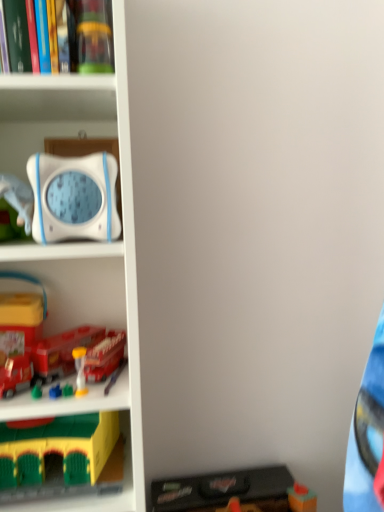
Question: Is white plastic bookcase at left positioned before hardcover book at upper left?

Choices:
 (A) no
 (B) yes

Answer: (B)

Question: Is white plastic bookcase at left located outside hardcover book at upper left?

Choices:
 (A) yes
 (B) no

Answer: (A)

Question: Is white plastic bookcase at left in contact with hardcover book at upper left?

Choices:
 (A) no
 (B) yes

Answer: (A)

Question: Can you confirm if white plastic bookcase at left is shorter than hardcover book at upper left?

Choices:
 (A) no
 (B) yes

Answer: (A)

Question: Is white plastic bookcase at left facing towards hardcover book at upper left?

Choices:
 (A) no
 (B) yes

Answer: (B)

Question: Is hardcover book at upper left inside the boundaries of translucent plastic hourglass at lower left, marked as the 2th toy in a left-to-right arrangement, or outside?

Choices:
 (A) outside
 (B) inside

Answer: (A)

Question: From the image's perspective, relative to translucent plastic hourglass at lower left, which appears as the 3th toy when viewed from the right, is hardcover book at upper left above or below?

Choices:
 (A) below
 (B) above

Answer: (B)

Question: Is point (8, 13) positioned closer to the camera than point (82, 373)?

Choices:
 (A) farther
 (B) closer

Answer: (B)

Question: In terms of size, does hardcover book at upper left appear bigger or smaller than translucent plastic hourglass at lower left, the 2th toy viewed from the top?

Choices:
 (A) big
 (B) small

Answer: (A)

Question: In terms of width, does translucent plastic hourglass at lower left, the third toy from the bottom, look wider or thinner when compared to hardcover book at upper left?

Choices:
 (A) thin
 (B) wide

Answer: (A)

Question: From a real-world perspective, is translucent plastic hourglass at lower left, which appears as the 3th toy when viewed from the right, positioned above or below hardcover book at upper left?

Choices:
 (A) below
 (B) above

Answer: (A)

Question: Would you say translucent plastic hourglass at lower left, marked as the 2th toy in a left-to-right arrangement, is to the left or to the right of hardcover book at upper left in the picture?

Choices:
 (A) right
 (B) left

Answer: (A)

Question: Is point (x=82, y=358) positioned closer to the camera than point (x=44, y=41)?

Choices:
 (A) closer
 (B) farther

Answer: (B)

Question: From a real-world perspective, is black plastic toy at lower right, marked as the 1th toy in a right-to-left arrangement, physically located above or below yellow plastic building block at lower left, which is counted as the second toy, starting from the bottom?

Choices:
 (A) below
 (B) above

Answer: (A)

Question: Is black plastic toy at lower right, marked as the 1th toy in a right-to-left arrangement, wider or thinner than yellow plastic building block at lower left, which is the 1th toy from left to right?

Choices:
 (A) thin
 (B) wide

Answer: (A)